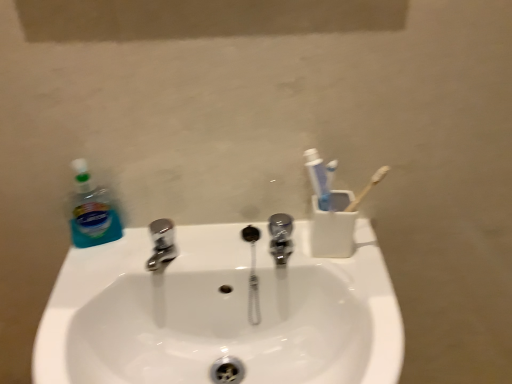
Identify the location of unoccupied area in front of white plastic toothbrush holder at upper right. This screenshot has width=512, height=384. (355, 284).